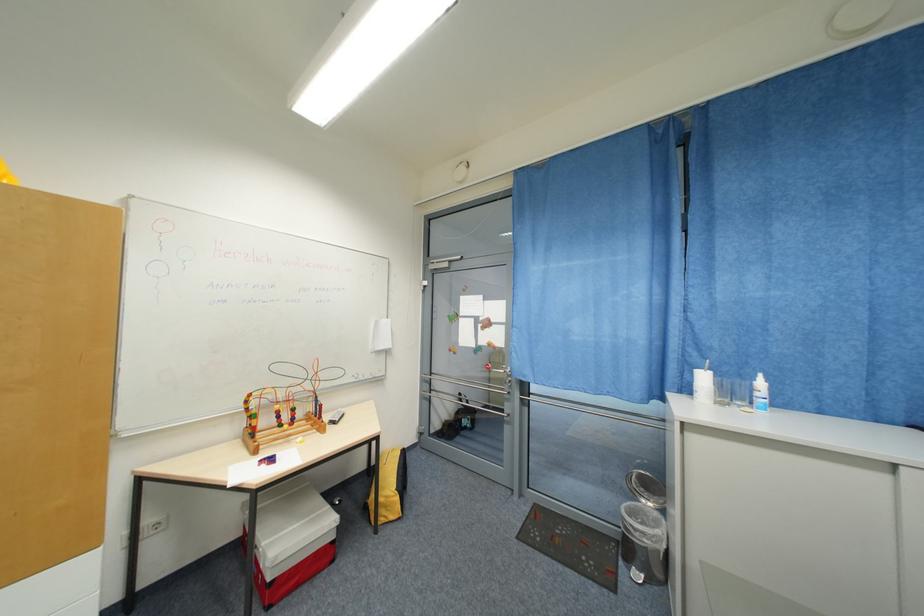
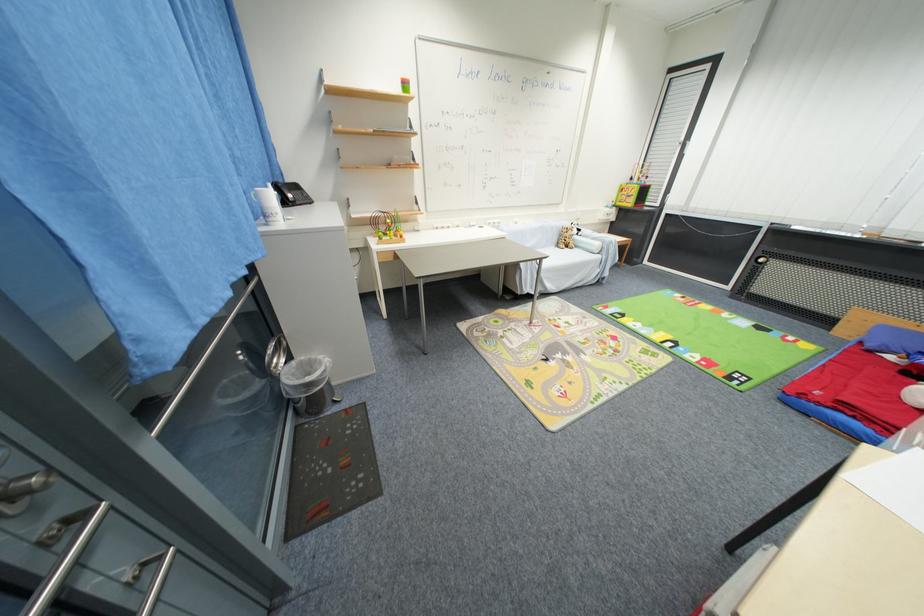
The point at (x=669, y=514) is marked in the first image. Where is the corresponding point in the second image?

(295, 360)